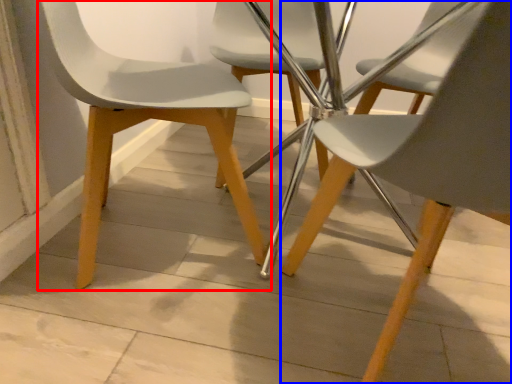
Question: Which point is closer to the camera, chair (highlighted by a red box) or chair (highlighted by a blue box)?

Choices:
 (A) chair
 (B) chair

Answer: (B)